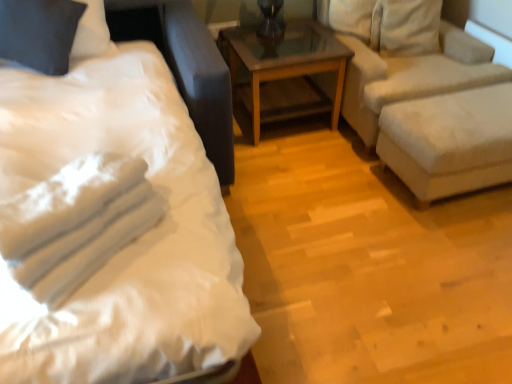
This screenshot has height=384, width=512. Identify the location of white cotton towels at left. (76, 223).

What is the approximate height of white cotton towels at left?

It is 8.90 inches.

The height and width of the screenshot is (384, 512). I want to click on white satin bed at left, so (112, 224).

Describe the element at coordinates (39, 33) in the screenshot. I see `dark gray fabric pillow at upper left` at that location.

In order to click on beige fabric studio couch at right in this screenshot , I will do `click(431, 113)`.

The height and width of the screenshot is (384, 512). In order to click on brown wooden table at center in this screenshot , I will do `click(282, 62)`.

This screenshot has height=384, width=512. Find the location of `white cotton towels at left`. white cotton towels at left is located at coordinates (76, 223).

Considering the relative sizes of white cotton towels at left and white satin bed at left in the image provided, is white cotton towels at left thinner than white satin bed at left?

Yes, white cotton towels at left is thinner than white satin bed at left.

This screenshot has height=384, width=512. Identify the location of material on the right side of white satin bed at left. (76, 223).

Does point (125, 159) come in front of point (187, 117)?

Yes, point (125, 159) is closer to viewer.

Could you tell me if white satin bed at left is turned towards white fabric ottoman at right?

No, white satin bed at left is not aimed at white fabric ottoman at right.

From the image's perspective, is white satin bed at left on top of white fabric ottoman at right?

Actually, white satin bed at left appears below white fabric ottoman at right in the image.

Is point (10, 123) less distant than point (451, 98)?

Yes.

How much distance is there between white satin bed at left and white fabric ottoman at right?

white satin bed at left is 4.21 feet away from white fabric ottoman at right.

From the picture: Does white fabric ottoman at right touch white satin bed at left?

No, white fabric ottoman at right is not next to white satin bed at left.

From a real-world perspective, between white fabric ottoman at right and white satin bed at left, who is vertically lower?

white fabric ottoman at right.

Does white fabric ottoman at right turn towards white satin bed at left?

No, white fabric ottoman at right does not turn towards white satin bed at left.

Locate an element on the screen. swivel chair located behind the white satin bed at left is located at coordinates (449, 141).

Does white fabric ottoman at right have a larger size compared to dark gray fabric pillow at upper left?

Yes.

Is point (465, 182) closer to viewer compared to point (58, 29)?

No.

Which object is positioned more to the right, white fabric ottoman at right or dark gray fabric pillow at upper left?

white fabric ottoman at right.

Is white fabric ottoman at right far away from dark gray fabric pillow at upper left?

Yes, white fabric ottoman at right is far from dark gray fabric pillow at upper left.

What's the angular difference between beige fabric studio couch at right and white satin bed at left's facing directions?

0.576 degrees separate the facing orientations of beige fabric studio couch at right and white satin bed at left.

Looking at their sizes, would you say beige fabric studio couch at right is wider or thinner than white satin bed at left?

In the image, beige fabric studio couch at right appears to be more narrow than white satin bed at left.

Does point (456, 118) appear closer or farther from the camera than point (40, 290)?

Point (456, 118) is positioned farther from the camera compared to point (40, 290).

From the image's perspective, is beige fabric studio couch at right beneath white satin bed at left?

Incorrect, from the image's perspective, beige fabric studio couch at right is higher than white satin bed at left.

From the image's perspective, is beige fabric studio couch at right on dark gray fabric pillow at upper left?

Yes.

Is beige fabric studio couch at right not near dark gray fabric pillow at upper left?

Indeed, beige fabric studio couch at right is not near dark gray fabric pillow at upper left.

Does beige fabric studio couch at right appear on the left side of dark gray fabric pillow at upper left?

No.

Is beige fabric studio couch at right spatially inside dark gray fabric pillow at upper left, or outside of it?

beige fabric studio couch at right is not enclosed by dark gray fabric pillow at upper left.

Can you confirm if dark gray fabric pillow at upper left is positioned to the left of white cotton towels at left?

Indeed, dark gray fabric pillow at upper left is positioned on the left side of white cotton towels at left.

Considering the sizes of objects dark gray fabric pillow at upper left and white cotton towels at left in the image provided, who is smaller, dark gray fabric pillow at upper left or white cotton towels at left?

white cotton towels at left.

From a real-world perspective, is dark gray fabric pillow at upper left over white cotton towels at left?

No, from a real-world perspective, dark gray fabric pillow at upper left is not over white cotton towels at left

Find the location of `material on the right of white satin bed at left`. material on the right of white satin bed at left is located at coordinates (76, 223).

The height and width of the screenshot is (384, 512). Find the location of `bed above the white fabric ottoman at right (from a real-world perspective)`. bed above the white fabric ottoman at right (from a real-world perspective) is located at coordinates (112, 224).

Estimate the real-world distances between objects in this image. Which object is further from beige fabric studio couch at right, dark gray fabric pillow at upper left or white cotton towels at left?

The object further to beige fabric studio couch at right is dark gray fabric pillow at upper left.

From the image, which object appears to be nearer to white fabric ottoman at right, dark gray fabric pillow at upper left or beige fabric studio couch at right?

Among the two, beige fabric studio couch at right is located nearer to white fabric ottoman at right.

Estimate the real-world distances between objects in this image. Which object is further from white cotton towels at left, white fabric ottoman at right or brown wooden table at center?

brown wooden table at center is further to white cotton towels at left.

Looking at the image, which one is located closer to white satin bed at left, brown wooden table at center or white cotton towels at left?

white cotton towels at left is positioned closer to the anchor white satin bed at left.

Based on their spatial positions, is dark gray fabric pillow at upper left or white satin bed at left further from white fabric ottoman at right?

dark gray fabric pillow at upper left lies further to white fabric ottoman at right than the other object.

Considering their positions, is white satin bed at left positioned closer to beige fabric studio couch at right than dark gray fabric pillow at upper left?

white satin bed at left is closer to beige fabric studio couch at right.

Based on their spatial positions, is brown wooden table at center or white fabric ottoman at right closer to beige fabric studio couch at right?

white fabric ottoman at right is closer to beige fabric studio couch at right.

When comparing their distances from white fabric ottoman at right, does dark gray fabric pillow at upper left or brown wooden table at center seem closer?

brown wooden table at center.

Identify the location of pillow positioned between white cotton towels at left and brown wooden table at center from near to far. (39, 33).

Image resolution: width=512 pixels, height=384 pixels. Find the location of `table between dark gray fabric pillow at upper left and white fabric ottoman at right`. table between dark gray fabric pillow at upper left and white fabric ottoman at right is located at coordinates (282, 62).

Find the location of a particular element. Image resolution: width=512 pixels, height=384 pixels. material between white satin bed at left and brown wooden table at center from front to back is located at coordinates (76, 223).

Image resolution: width=512 pixels, height=384 pixels. I want to click on table between dark gray fabric pillow at upper left and beige fabric studio couch at right in the horizontal direction, so [282, 62].